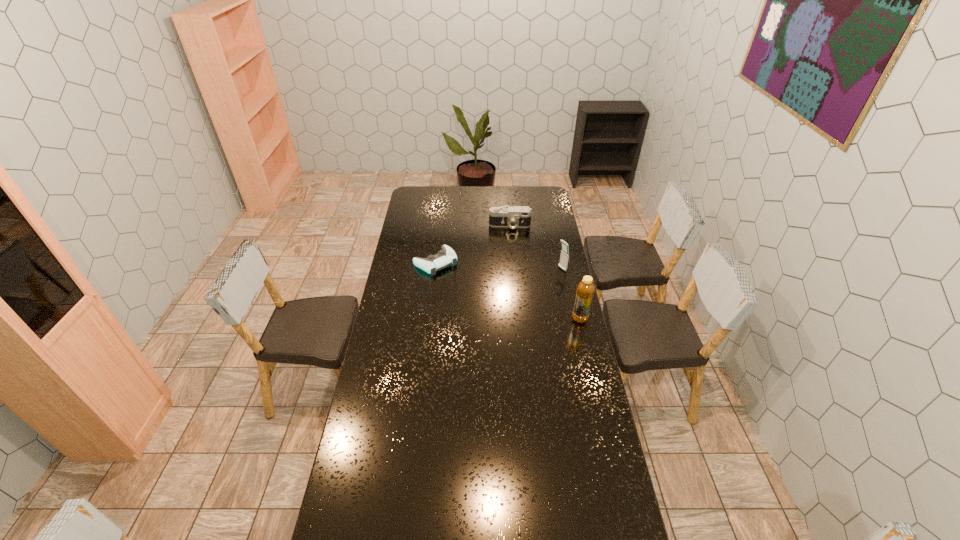
This screenshot has width=960, height=540. In order to click on blank area located 0.050m on the lens of the third tallest object in this screenshot , I will do `click(510, 237)`.

Locate an element on the screen. vacant space located on the lens of the third tallest object is located at coordinates (510, 261).

The width and height of the screenshot is (960, 540). In order to click on free space located on the front-facing side of the third shortest object in this screenshot , I will do `click(494, 302)`.

Locate an element on the screen. The image size is (960, 540). vacant area located 0.330m on the front-facing side of the third shortest object is located at coordinates (507, 296).

I want to click on vacant space situated on the front-facing side of the third shortest object, so click(x=533, y=284).

This screenshot has width=960, height=540. Find the location of `object present at the left edge`. object present at the left edge is located at coordinates coord(446,256).

Image resolution: width=960 pixels, height=540 pixels. What are the coordinates of `bottle located at the right edge` in the screenshot? It's located at (585, 290).

Find the location of a particular element. The image size is (960, 540). camera that is at the right edge is located at coordinates (514, 217).

You are a GUI agent. You are given a task and a screenshot of the screen. Output one action in this format:
    pyautogui.click(x=<x>, y=<y>)
    Task: Click on the cellular telephone that is at the right edge
    This screenshot has height=540, width=960.
    Given the screenshot: What is the action you would take?
    pyautogui.click(x=564, y=257)

At what (x,y) coordinates should I click in order to perform the action: click on vacant space at the far edge. Please return your answer as a coordinate pair (x, y). Looking at the image, I should click on (518, 196).